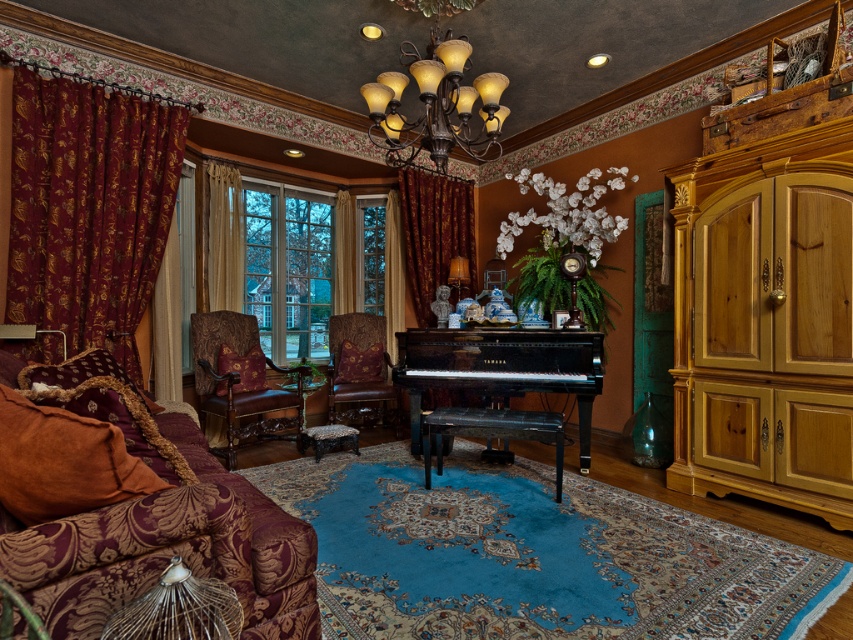
Question: Is the position of velvet burgundy couch at left less distant than that of leather armchair at center?

Choices:
 (A) no
 (B) yes

Answer: (B)

Question: Estimate the real-world distances between objects in this image. Which object is farther from the maroon silk curtains at left?

Choices:
 (A) velvet brown armchair at center
 (B) velvet burgundy curtain at center
 (C) leather armchair at center
 (D) light brown wood armoire at right

Answer: (D)

Question: Which of the following is the closest to the observer?

Choices:
 (A) leather armchair at center
 (B) maroon silk curtains at left
 (C) velvet burgundy curtain at left

Answer: (B)

Question: Can you confirm if velvet burgundy curtain at center is wider than leather armchair at center?

Choices:
 (A) yes
 (B) no

Answer: (A)

Question: Which object appears farthest from the camera in this image?

Choices:
 (A) velvet brown armchair at center
 (B) velvet burgundy curtain at center

Answer: (B)

Question: Can you confirm if bronze textured chandelier at upper center is bigger than velvet burgundy curtain at left?

Choices:
 (A) no
 (B) yes

Answer: (B)